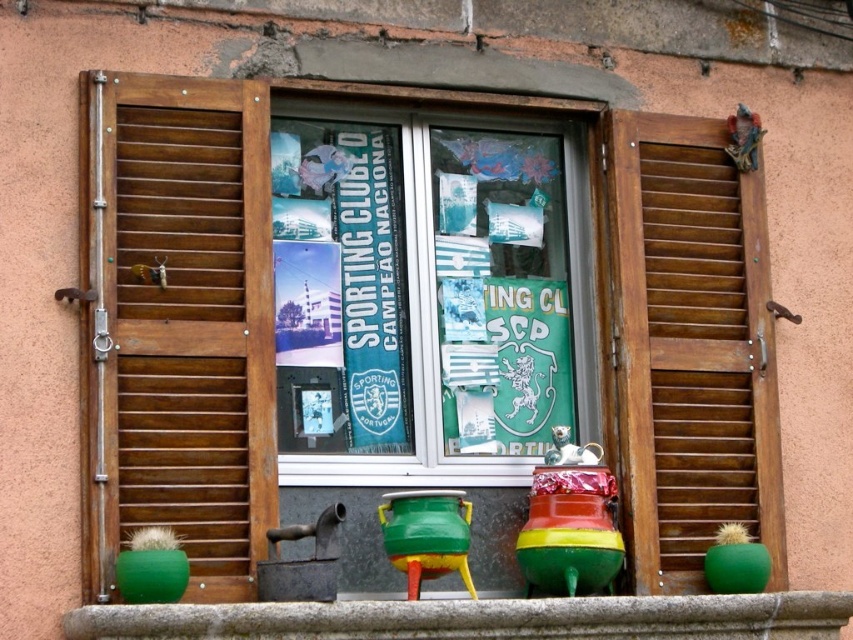
Question: Which of these objects is positioned closest to the wooden slats at left?

Choices:
 (A) green ceramic pot at lower center
 (B) wooden at right

Answer: (A)

Question: Can you confirm if green glossy poster at center is positioned to the right of wooden at right?

Choices:
 (A) no
 (B) yes

Answer: (A)

Question: Which of the following is the closest to the observer?

Choices:
 (A) (780, 624)
 (B) (373, 132)

Answer: (A)

Question: Estimate the real-world distances between objects in this image. Which object is farther from the green ceramic pot at lower center?

Choices:
 (A) wooden at right
 (B) green glossy poster at center

Answer: (B)

Question: Can you confirm if green glossy poster at center is bigger than green ceramic pot at lower center?

Choices:
 (A) no
 (B) yes

Answer: (B)

Question: Observing the image, what is the correct spatial positioning of wooden slats at left in reference to wooden at right?

Choices:
 (A) above
 (B) below

Answer: (A)